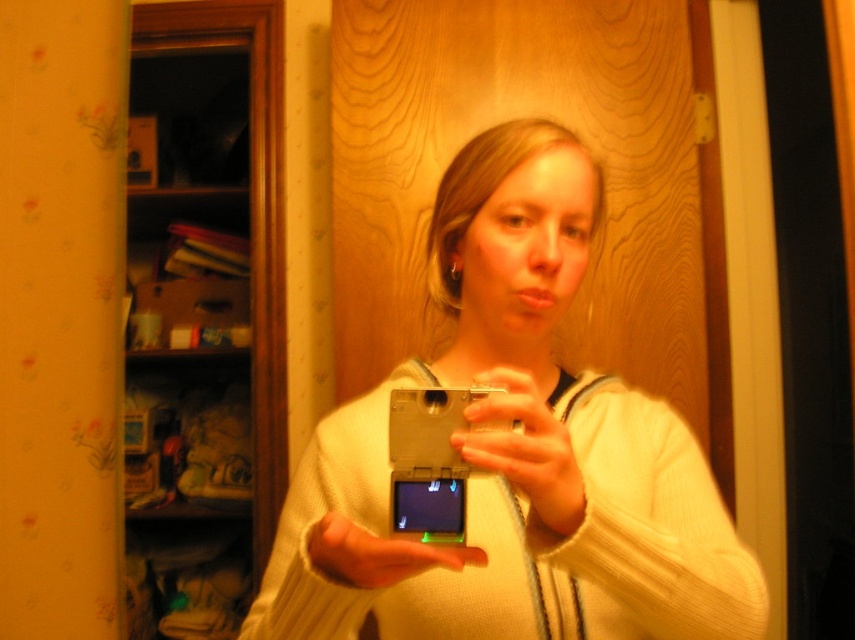
You are trying to decide which device to use for taking a selfie in the bathroom. The silver metallic camera at center and the metallic silver phone at center are both in your hand. Based on their sizes, which one would allow you to hold it farther away from your face while still capturing your full reflection in the mirror?

The silver metallic camera at center is much taller than the metallic silver phone at center, so it can capture a wider angle and thus allow you to hold it farther away while still capturing your full reflection in the mirror.